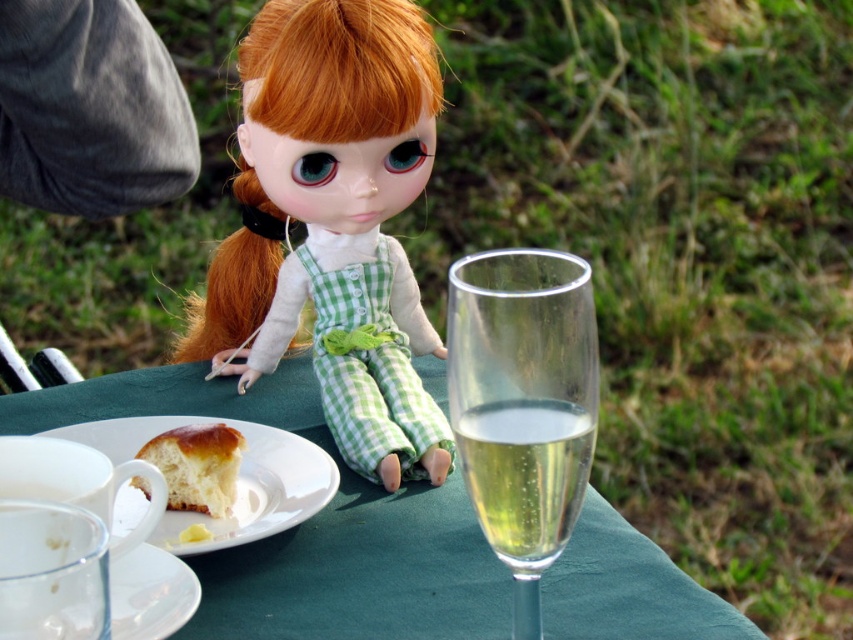
Does point (558, 396) come in front of point (221, 458)?

Yes.

Does clear glass wine glass at center come in front of golden brown bread at center?

Yes, it is.

The image size is (853, 640). Identify the location of clear glass wine glass at center. (523, 404).

Locate an element on the screen. clear glass wine glass at center is located at coordinates (523, 404).

Between green checkered doll at center and transparent glass saucer at lower left, which one appears on the right side from the viewer's perspective?

green checkered doll at center

Is point (419, 324) positioned after point (187, 605)?

Yes, it is behind point (187, 605).

This screenshot has height=640, width=853. Find the location of `green checkered doll at center`. green checkered doll at center is located at coordinates (335, 221).

Between golden brown bread at center and transparent glass saucer at lower left, which one is positioned higher?

golden brown bread at center is higher up.

Does golden brown bread at center appear on the left side of transparent glass saucer at lower left?

Indeed, golden brown bread at center is positioned on the left side of transparent glass saucer at lower left.

Does point (206, 480) come in front of point (149, 600)?

That is False.

Identify the location of golden brown bread at center. The width and height of the screenshot is (853, 640). (196, 467).